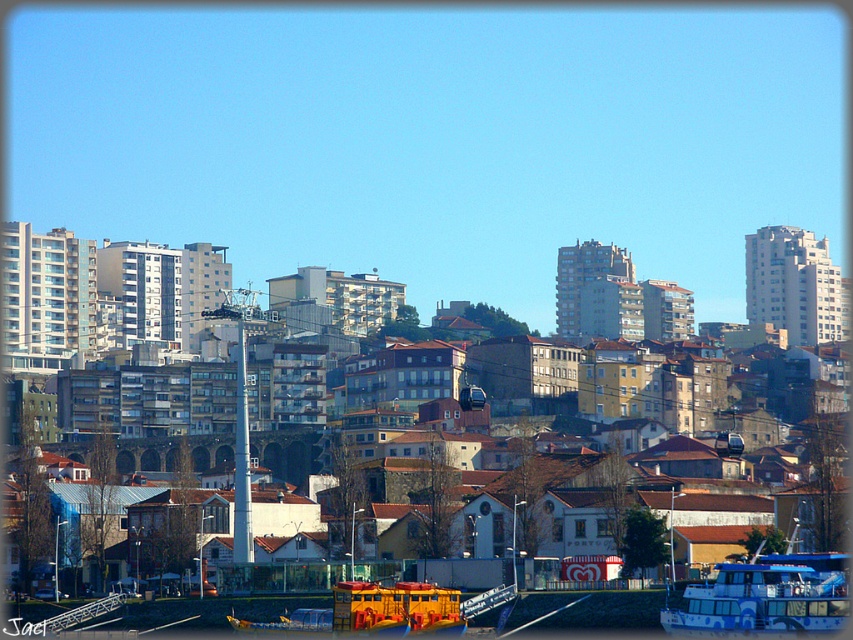
Based on the photo, you are a tourist standing on the dock and want to take a photo of both the blue glossy boat at lower right and the yellow matte boat at lower center. Which boat should you position yourself closer to in order to include both in your camera frame?

You should position yourself closer to the yellow matte boat at lower center because the blue glossy boat at lower right is above it, so by being nearer to the lower boat, both will fit within the frame.

You are a tour guide leading a group to the small red kiosk with a heart sign. You see the blue glossy boat at lower right and the yellow matte boat at lower center. Which boat is closer to the kiosk?

The yellow matte boat at lower center is closer to the small red kiosk with a heart sign because the blue glossy boat at lower right is positioned on the right side of it, placing the yellow matte boat at lower center between the kiosk and the blue boat.